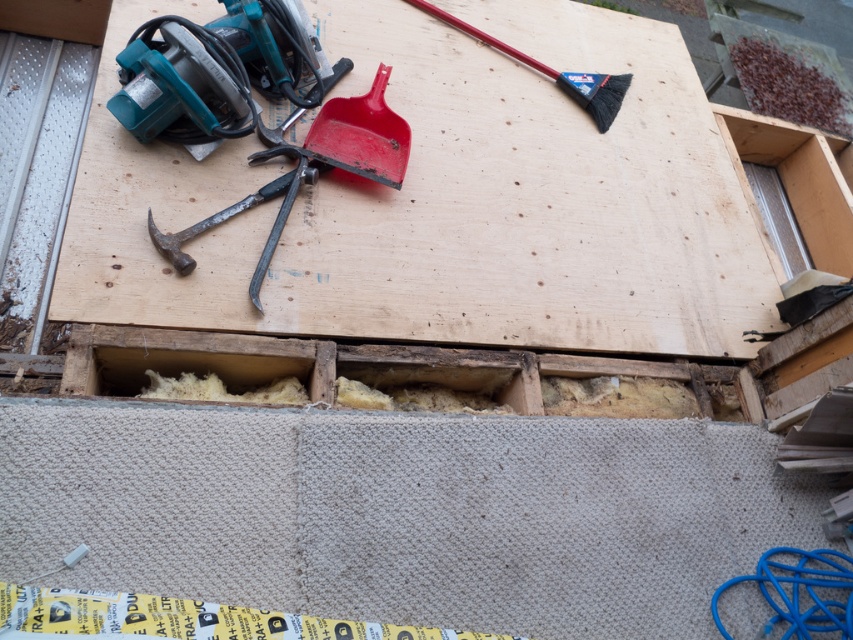
Question: Which of the following is the closest to the observer?

Choices:
 (A) rusty metal hammer at center
 (B) black plastic brush at upper right

Answer: (A)

Question: Can you confirm if black plastic brush at upper right is thinner than rusty metal hammer at center?

Choices:
 (A) yes
 (B) no

Answer: (B)

Question: Is metallic hammer at left below rusty metal hammer at center?

Choices:
 (A) yes
 (B) no

Answer: (B)

Question: Which point appears closest to the camera in this image?

Choices:
 (A) (291, 148)
 (B) (538, 61)
 (C) (186, 259)
 (D) (416, 257)

Answer: (C)

Question: Which of the following is the farthest from the observer?

Choices:
 (A) rusty metal hammer at center
 (B) black plastic brush at upper right
 (C) pine wood at center

Answer: (B)

Question: In this image, where is pine wood at center located relative to black plastic brush at upper right?

Choices:
 (A) below
 (B) above

Answer: (A)